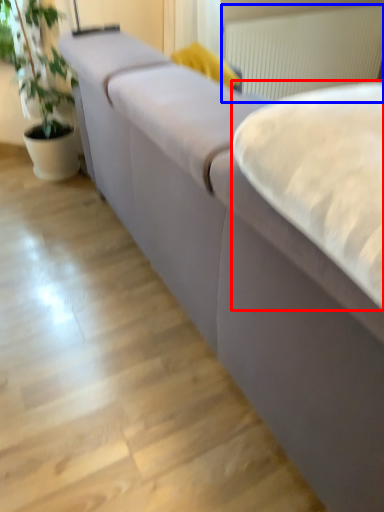
Question: Among these objects, which one is farthest to the camera, sheet (highlighted by a red box) or radiator (highlighted by a blue box)?

Choices:
 (A) sheet
 (B) radiator

Answer: (B)